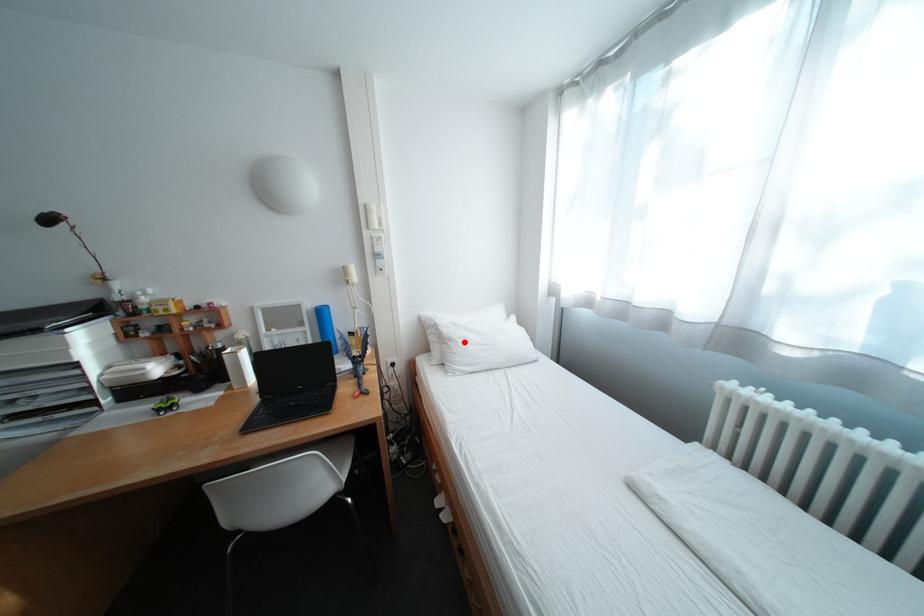
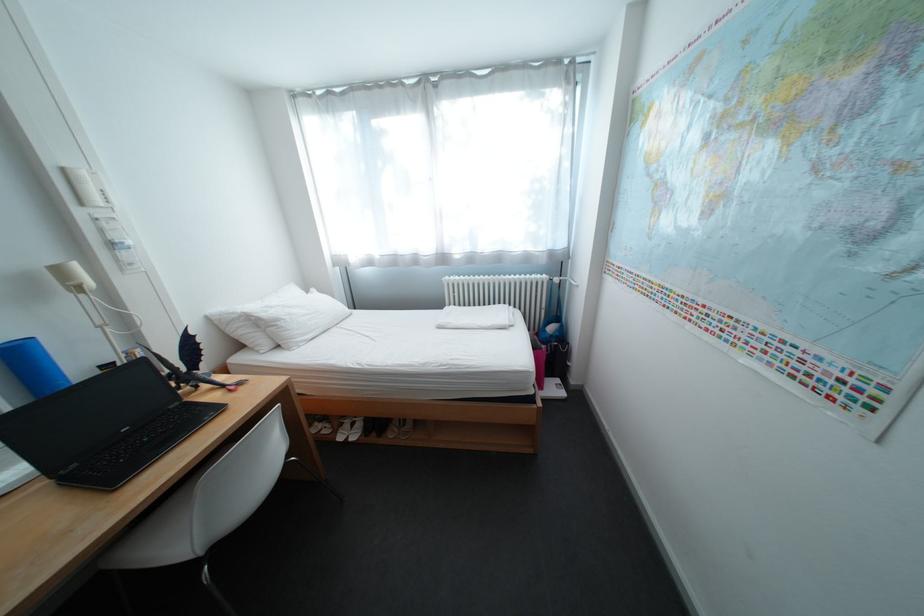
Question: I am providing you with two images of the same scene from different viewpoints. Given a red point in image1, look at the same physical point in image2. Is it:

Choices:
 (A) Closer to the viewpoint
 (B) Farther from the viewpoint

Answer: (A)